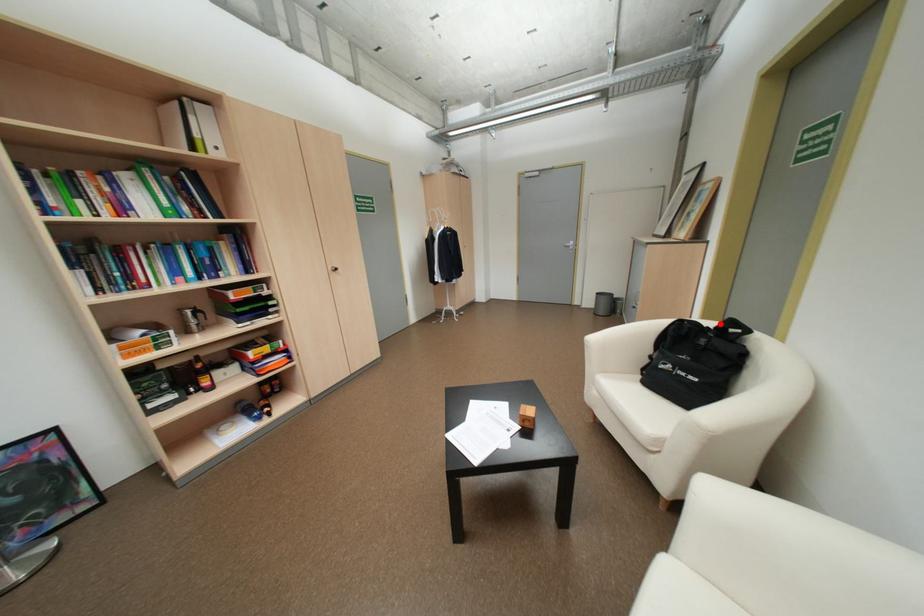
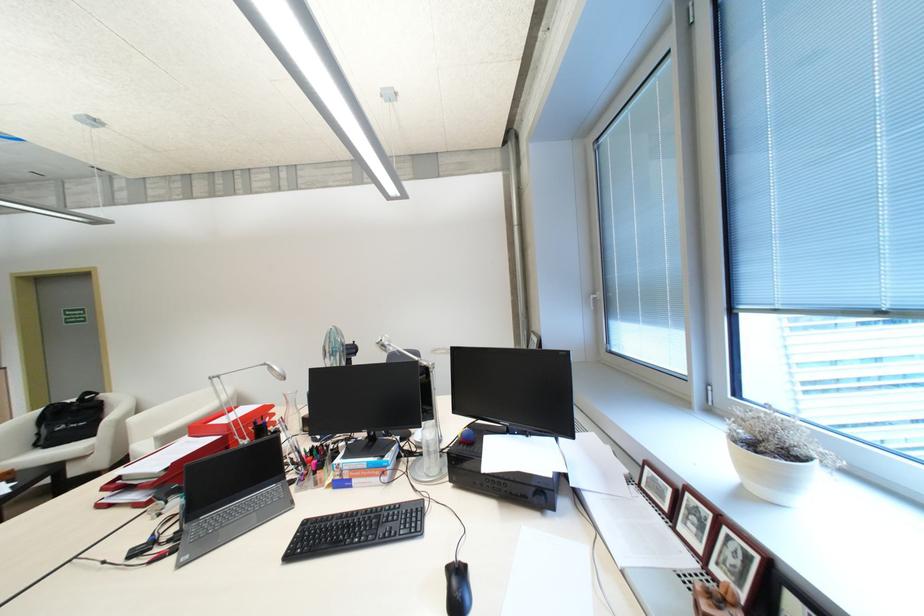
In the second image, find the point that corresponds to the highlighted location in the first image.

(82, 399)